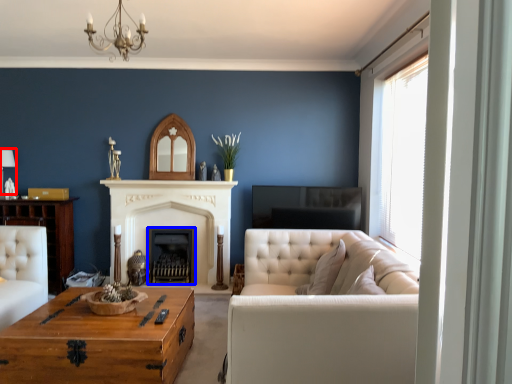
Question: Which of the following is the farthest to the observer, lamp (highlighted by a red box) or fireplace (highlighted by a blue box)?

Choices:
 (A) lamp
 (B) fireplace

Answer: (B)